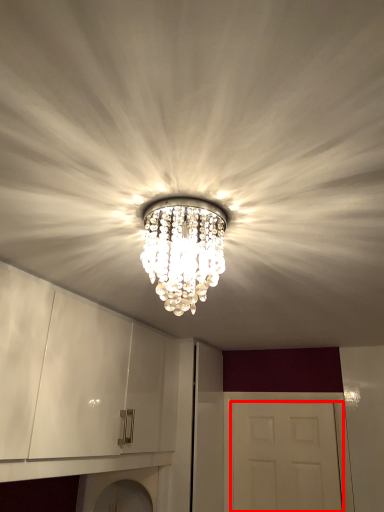
Question: From the image's perspective, what is the correct spatial positioning of door (annotated by the red box) in reference to lamp?

Choices:
 (A) below
 (B) above

Answer: (A)